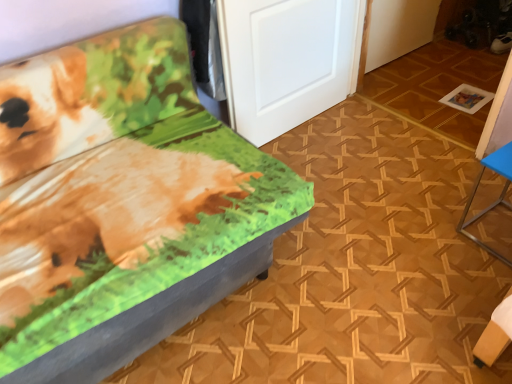
Identify the location of unoccupied space behind blue metallic table at right, which is the 2th furniture from left to right. Image resolution: width=512 pixels, height=384 pixels. (469, 192).